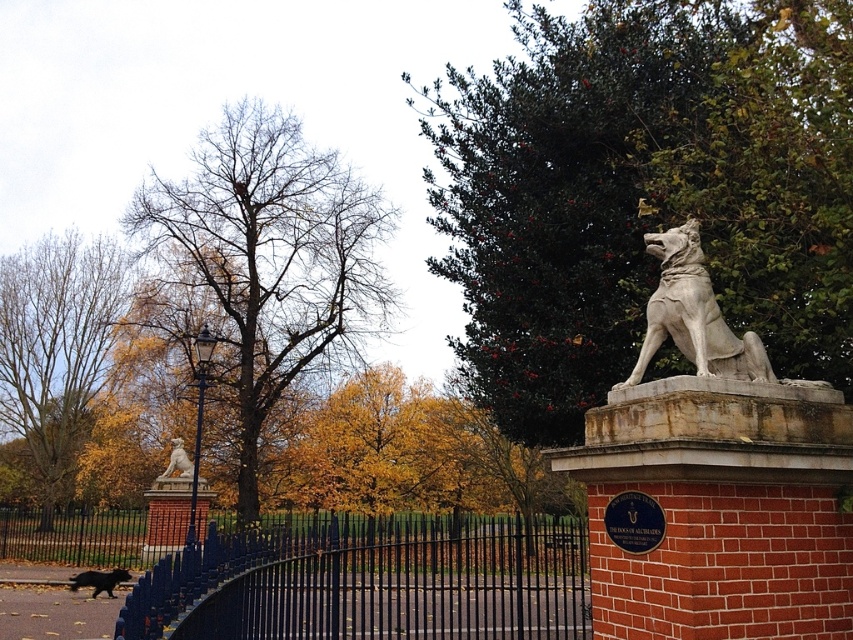
You are a park visitor wanting to take a photo of the green leafy tree at upper right and the yellow leaves at upper left. Which tree is closer to the camera?

The yellow leaves at upper left are closer to the camera because they appear larger and are positioned higher up in the frame compared to the green leafy tree at upper right.

You are standing in the park and notice the shiny black dog at lower left and the yellow leaves at upper left. From your perspective, which object is positioned to the left side?

The yellow leaves at upper left are to the left of the shiny black dog at lower left, so the yellow leaves at upper left are positioned to the left side.